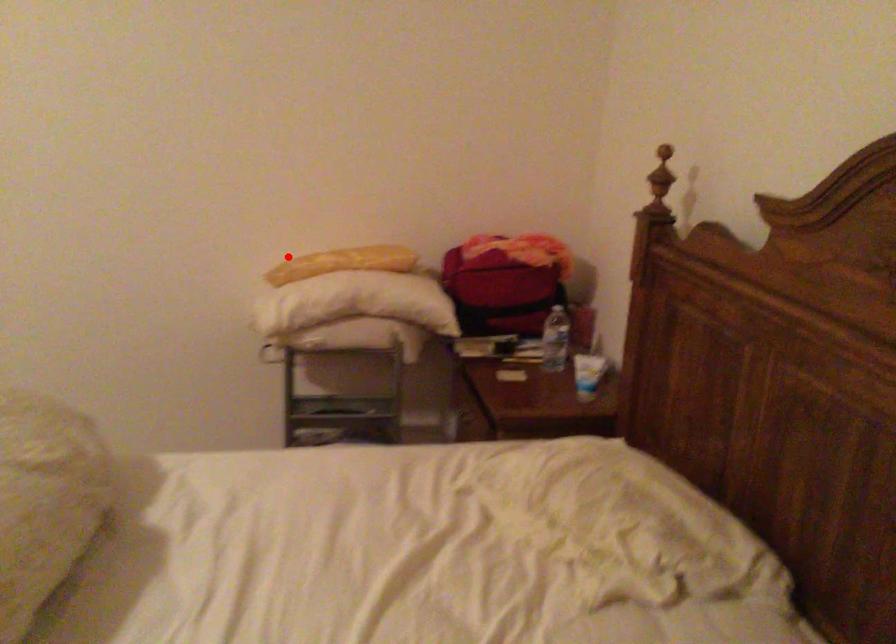
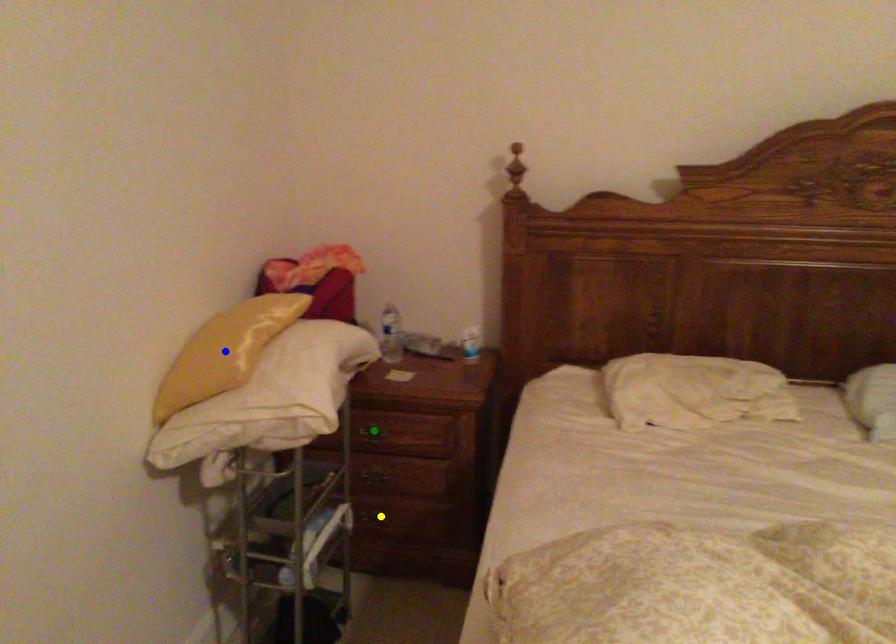
Question: I am providing you with two images of the same scene from different viewpoints. A red point is marked on the first image. You are given multiple points on the second image. Which point in image 2 is actually the same real-world point as the red point in image 1?

Choices:
 (A) blue point
 (B) yellow point
 (C) green point

Answer: (A)